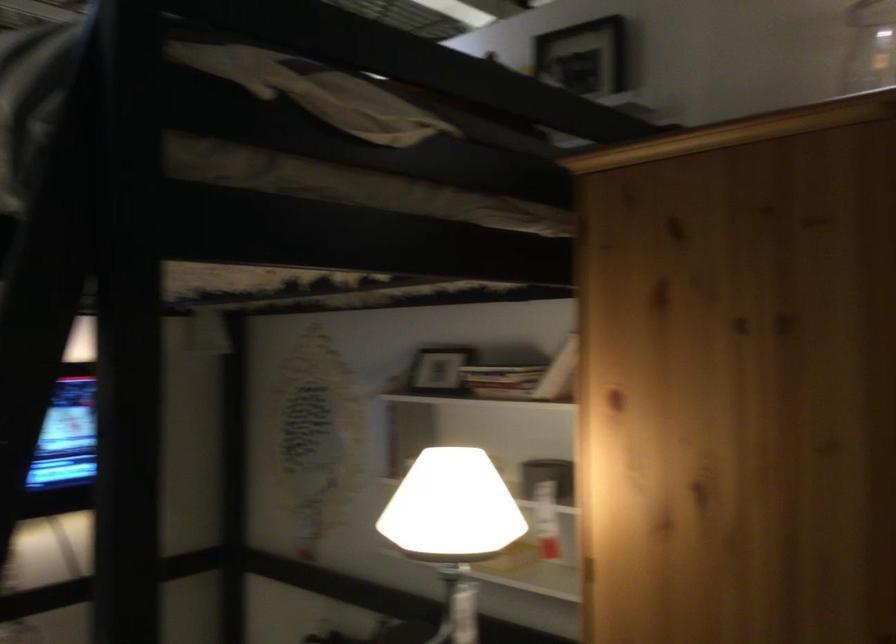
Which object does [435,372] point to?

It corresponds to the small picture frame in the image.